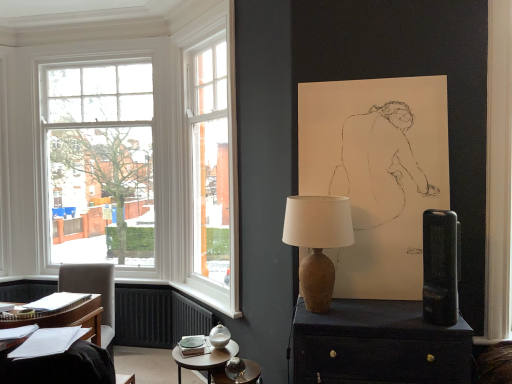
Question: Which is correct: brown ceramic lamp at center is inside black plastic speaker at right, or outside of it?

Choices:
 (A) outside
 (B) inside

Answer: (A)

Question: Based on their sizes in the image, would you say brown ceramic lamp at center is bigger or smaller than black plastic speaker at right?

Choices:
 (A) small
 (B) big

Answer: (B)

Question: Which is nearer to the matte brown side table at lower center?

Choices:
 (A) matte brown cabinet at center
 (B) white glass window at left
 (C) brown ceramic lamp at center
 (D) black plastic speaker at right
 (E) light gray fabric chair at left

Answer: (A)

Question: Based on their relative distances, which object is farther from the white glass window at left?

Choices:
 (A) brown ceramic lamp at center
 (B) white paper at lower left
 (C) matte brown side table at lower center
 (D) matte brown cabinet at center
 (E) black plastic speaker at right

Answer: (E)